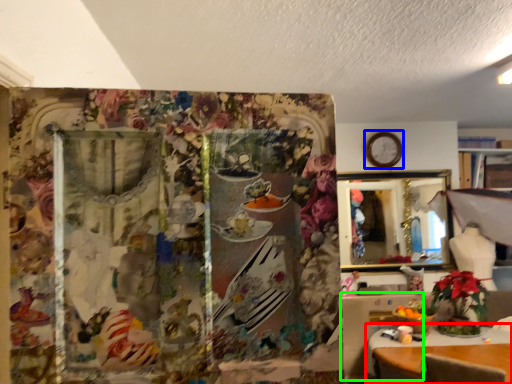
Question: Based on their relative distances, which object is nearer to table (highlighted by a red box)? Choose from clock (highlighted by a blue box) and table (highlighted by a green box).

Choices:
 (A) clock
 (B) table

Answer: (B)